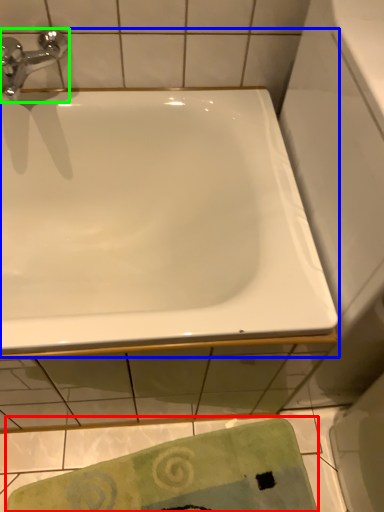
Question: Which is farther away from beach towel (highlighted by a red box)? bathtub (highlighted by a blue box) or tap (highlighted by a green box)?

Choices:
 (A) bathtub
 (B) tap

Answer: (B)